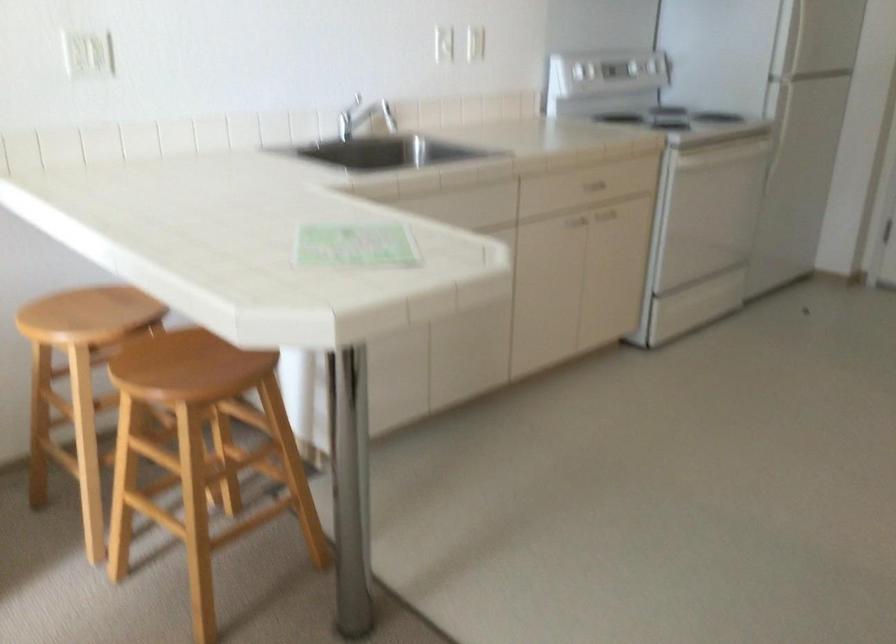
Find where to turn the metal faucet handle. Please return your answer as a coordinate pair (x, y).

(375, 111)